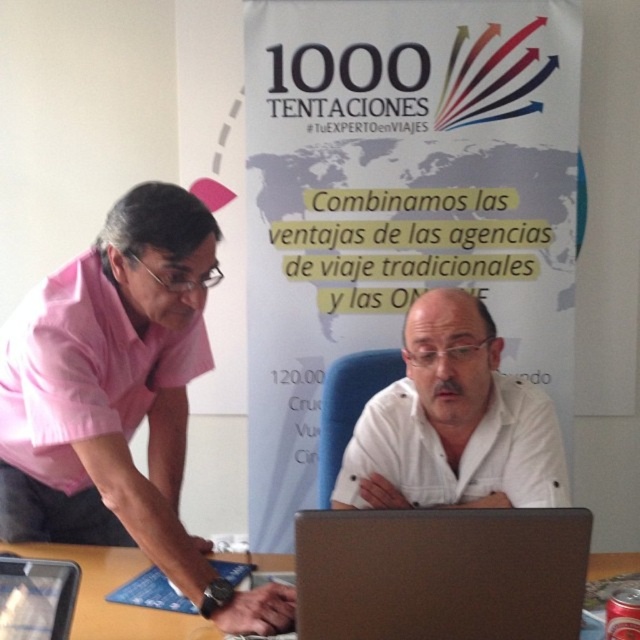
Question: Which of the following is the farthest from the observer?

Choices:
 (A) white matte shirt at center
 (B) silver metallic laptop at center
 (C) wooden table at center
 (D) pink cotton shirt at left

Answer: (A)

Question: Does wooden table at center appear under silver metallic laptop at center?

Choices:
 (A) no
 (B) yes

Answer: (B)

Question: Which of these objects is positioned closest to the silver metallic laptop at center?

Choices:
 (A) white matte shirt at center
 (B) brown matte laptop at center
 (C) wooden table at center

Answer: (C)

Question: Is white paperboard at upper center further to the viewer compared to pink cotton shirt at left?

Choices:
 (A) yes
 (B) no

Answer: (A)

Question: Can you confirm if white paperboard at upper center is wider than silver metallic laptop at center?

Choices:
 (A) yes
 (B) no

Answer: (A)

Question: Which of the following is the farthest from the observer?

Choices:
 (A) white matte shirt at center
 (B) wooden table at center

Answer: (A)